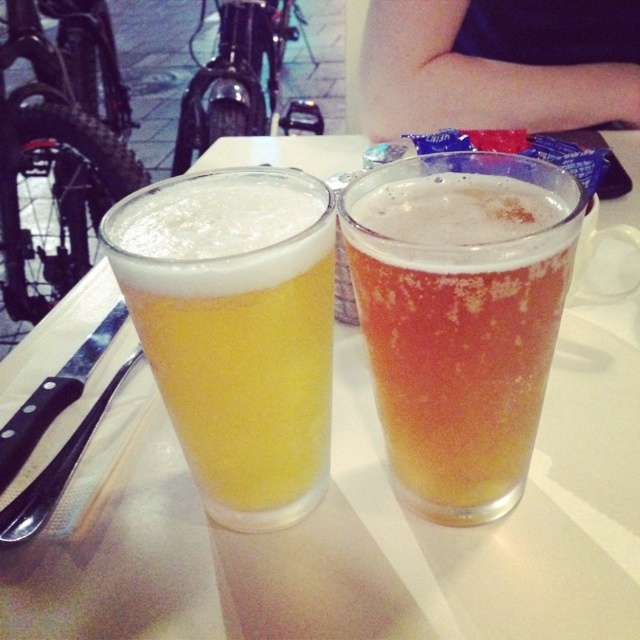
Question: Observing the image, what is the correct spatial positioning of dark blue fabric at upper center in reference to black plastic knife at left?

Choices:
 (A) left
 (B) right

Answer: (B)

Question: Is translucent glass at left smaller than black plastic knife at left?

Choices:
 (A) no
 (B) yes

Answer: (A)

Question: Which object is the closest to the black plastic knife at left?

Choices:
 (A) dark blue fabric at upper center
 (B) translucent glass at center
 (C) translucent glass at left

Answer: (C)

Question: Which object is closer to the camera taking this photo?

Choices:
 (A) translucent glass at center
 (B) translucent glass at left
 (C) black plastic knife at left
 (D) dark blue fabric at upper center

Answer: (A)

Question: Which is nearer to the translucent glass at left?

Choices:
 (A) translucent glass at center
 (B) dark blue fabric at upper center

Answer: (A)

Question: Can you confirm if translucent glass at center is wider than black plastic knife at left?

Choices:
 (A) no
 (B) yes

Answer: (B)